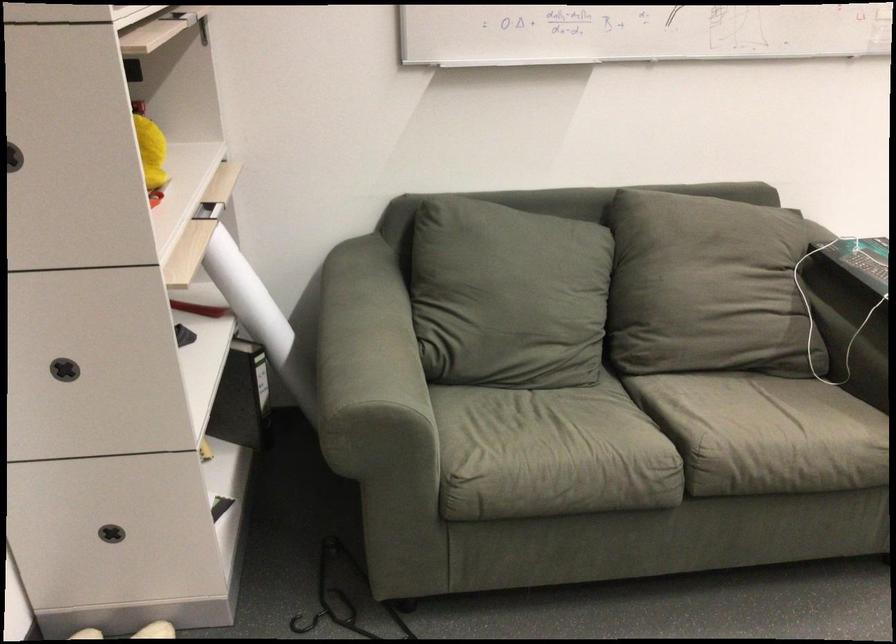
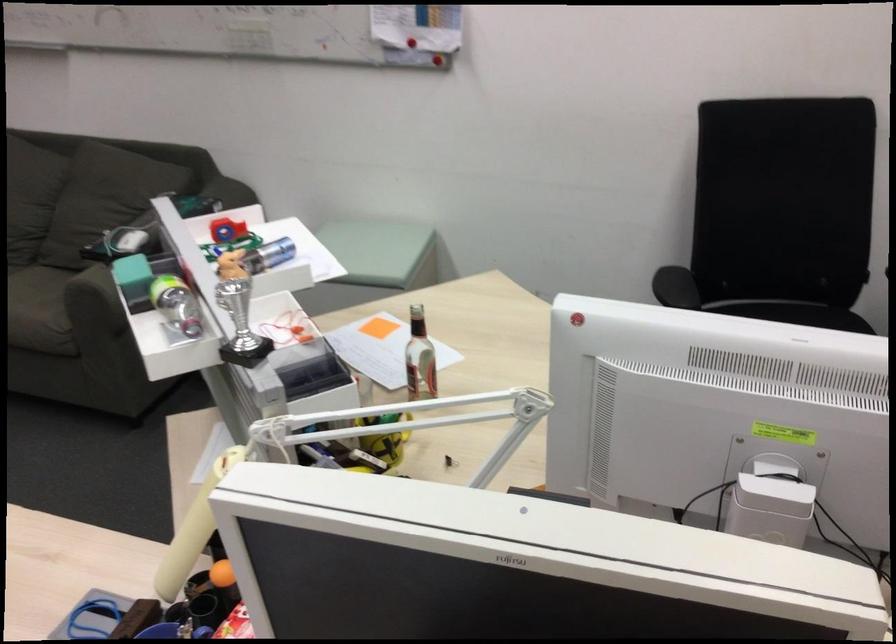
Question: In a continuous first-person perspective shot, in which direction is the camera moving?

Choices:
 (A) Left
 (B) Right
 (C) Forward
 (D) Backward

Answer: (B)